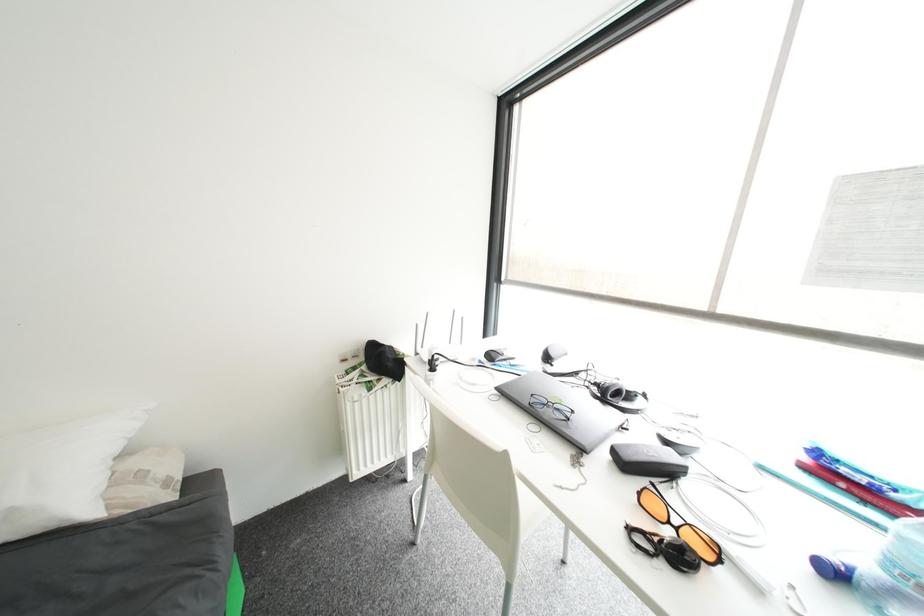
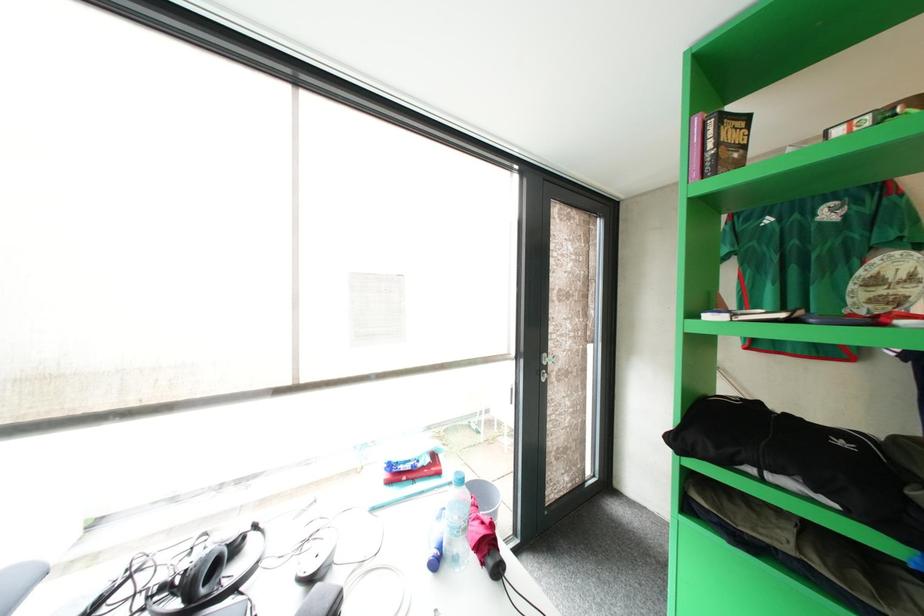
Question: The first image is from the beginning of the video and the second image is from the end. How did the camera likely rotate when shooting the video?

Choices:
 (A) Left
 (B) Right
 (C) Up
 (D) Down

Answer: (B)